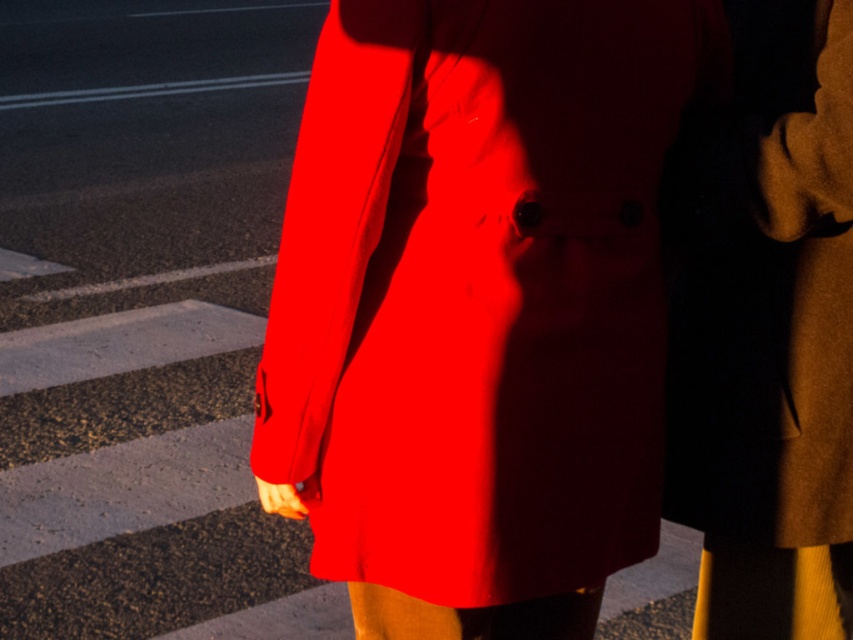
You are a photographer holding a camera. You want to take a photo of the matte red coat at center from a distance that allows the entire coat to fit in the frame without cropping. Your camera has a minimum focusing distance of 1.5 meters. Can you take the photo without moving closer?

The matte red coat at center and camera are 1.47 meters apart, which is less than the camera minimum focusing distance of 1.5 meters. Therefore, you cannot take the photo without moving closer.

Consider the image. You are a fashion designer observing two coats in a photo. The first is a matte red coat at center, and the second is a brown woolen trench coat at right. Which coat is covering part of the other in the image?

The matte red coat at center is positioned over the brown woolen trench coat at right, so it is covering part of the brown woolen trench coat at right.